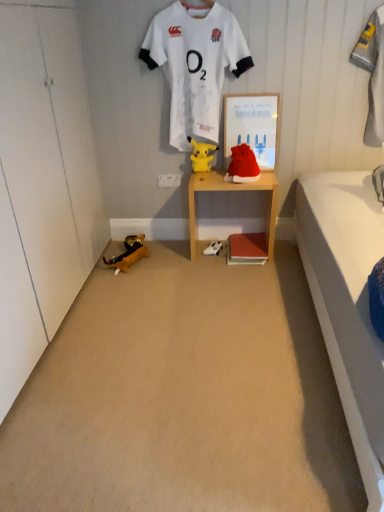
The height and width of the screenshot is (512, 384). What are the coordinates of `vacant area that is in front of white fabric shoe at lower center` in the screenshot? It's located at (212, 262).